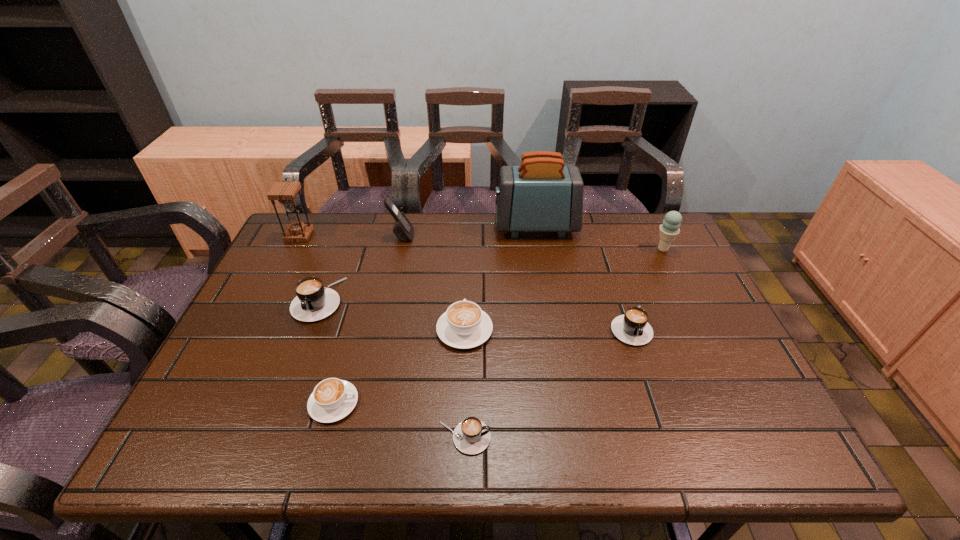
You are a GUI agent. You are given a task and a screenshot of the screen. Output one action in this format:
    pyautogui.click(x=<x>, y=<y>)
    Task: Click on the free space between the ice cream and the smaller white cappuccino
    The width and height of the screenshot is (960, 540).
    Given the screenshot: What is the action you would take?
    pyautogui.click(x=498, y=326)

I want to click on vacant area between the farther white cappuccino and the toaster, so click(x=500, y=278).

At what (x,y) coordinates should I click in order to perform the action: click on empty space that is in between the left white cappuccino and the seventh object from left to right. Please return your answer as a coordinate pair (x, y). Looking at the image, I should click on (435, 315).

Find the location of a particular element. This screenshot has height=540, width=960. the fifth closest object to the leftmost cappuccino is located at coordinates (471, 436).

Find the location of `the sixth closest object relative to the nearer white cappuccino`. the sixth closest object relative to the nearer white cappuccino is located at coordinates (632, 328).

Identify the location of cappuccino that stands as the closest to the fourth cappuccino from right to left. (464, 325).

You are a GUI agent. You are given a task and a screenshot of the screen. Output one action in this format:
    pyautogui.click(x=<x>, y=<y>)
    Task: Click on the cappuccino that is the fourth closest to the blue ice cream
    The width and height of the screenshot is (960, 540).
    Given the screenshot: What is the action you would take?
    pyautogui.click(x=313, y=302)

Identify the location of the second closest black cappuccino to the second black cappuccino from right to left. This screenshot has height=540, width=960. (313, 302).

Find the location of a particular element. the closest black cappuccino to the biggest black cappuccino is located at coordinates (471, 436).

This screenshot has height=540, width=960. I want to click on blank space that satisfies the following two spatial constraints: 1. on the front-facing side of the ice cream; 2. on the right side of the cellular telephone, so click(x=399, y=249).